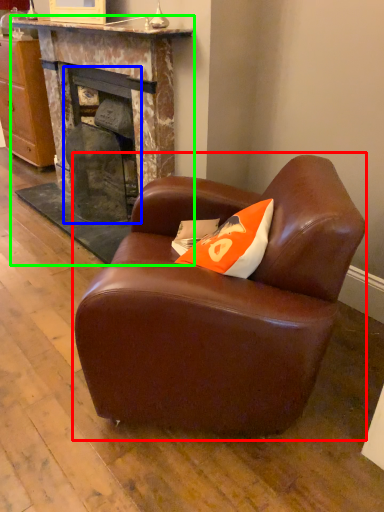
Question: Estimate the real-world distances between objects in this image. Which object is farther from chair (highlighted by a red box), fireplace (highlighted by a blue box) or fireplace (highlighted by a green box)?

Choices:
 (A) fireplace
 (B) fireplace

Answer: (A)